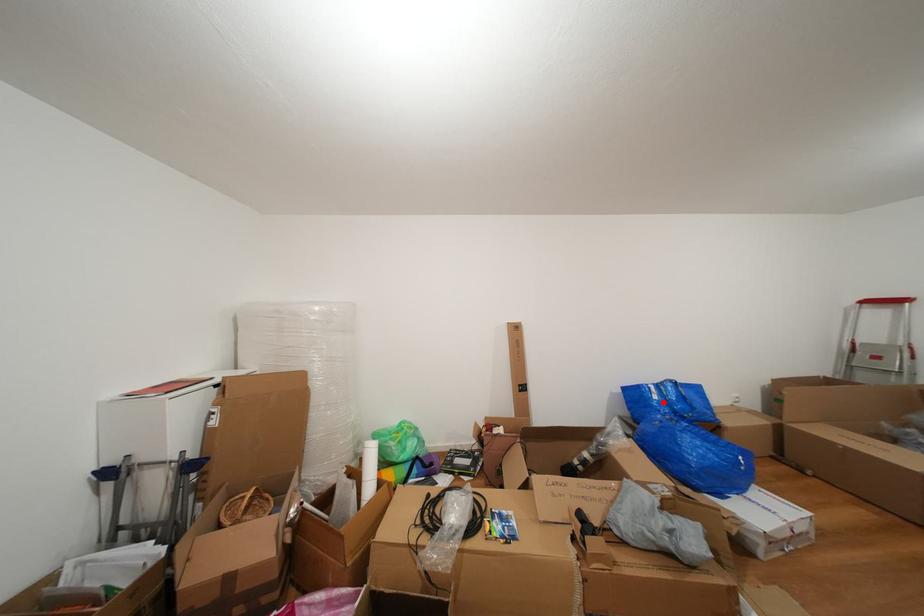
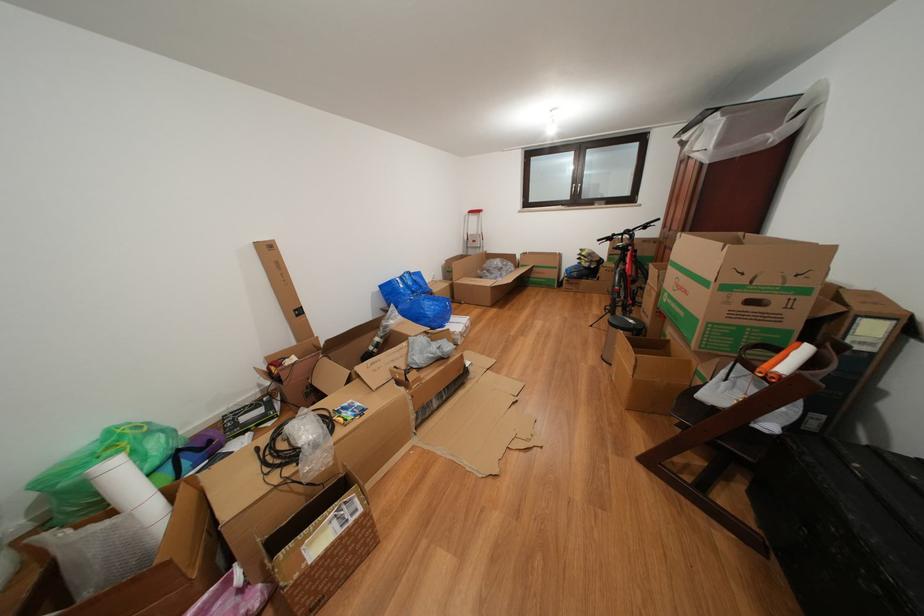
Question: I am providing you with two images of the same scene from different viewpoints. In image1, a red point is highlighted. Considering the same 3D point in image2, which of the following is correct?

Choices:
 (A) It is closer
 (B) It is farther

Answer: (A)